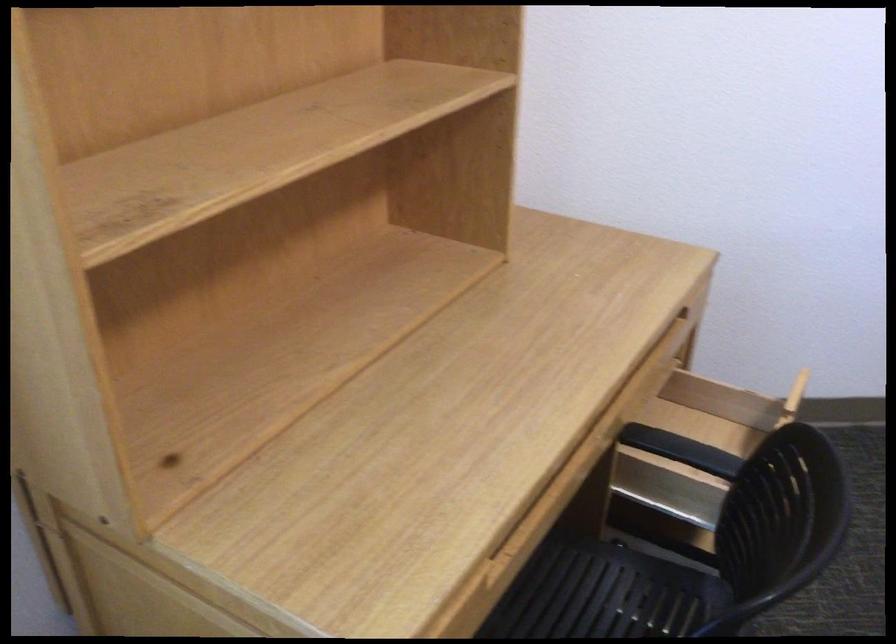
Find the location of a particular element. wooden drawer handle is located at coordinates (691, 313).